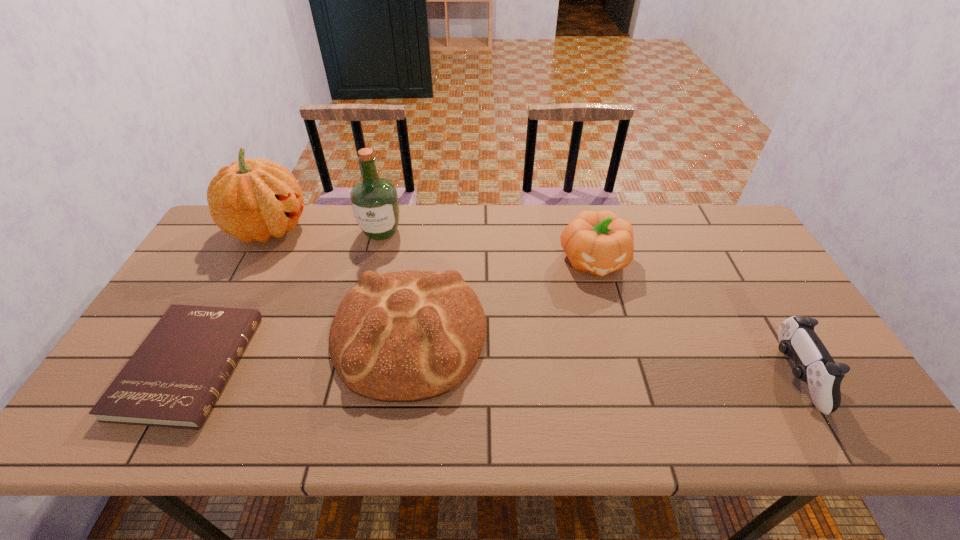
Identify the location of liquor. The width and height of the screenshot is (960, 540). (374, 200).

The height and width of the screenshot is (540, 960). What are the coordinates of `the taller pumpkin` in the screenshot? It's located at (251, 200).

You are a GUI agent. You are given a task and a screenshot of the screen. Output one action in this format:
    pyautogui.click(x=<x>, y=<y>)
    Task: Click on the second object from right to left
    This screenshot has width=960, height=540.
    Given the screenshot: What is the action you would take?
    pyautogui.click(x=599, y=243)

Where is `the right pumpkin`? This screenshot has width=960, height=540. the right pumpkin is located at coordinates (599, 243).

The height and width of the screenshot is (540, 960). Identify the location of bread. (405, 336).

Identify the location of control. (797, 339).

Image resolution: width=960 pixels, height=540 pixels. Find the location of `the shortest object`. the shortest object is located at coordinates (173, 379).

Where is `free space located 0.170m on the front-facing side of the liquor`? This screenshot has height=540, width=960. free space located 0.170m on the front-facing side of the liquor is located at coordinates (368, 284).

Where is `vacant space situated on the carved face of the left pumpkin`? The image size is (960, 540). vacant space situated on the carved face of the left pumpkin is located at coordinates (327, 228).

Find the location of `vacant space located 0.390m on the carved face of the fifth object from left to right`. vacant space located 0.390m on the carved face of the fifth object from left to right is located at coordinates (634, 408).